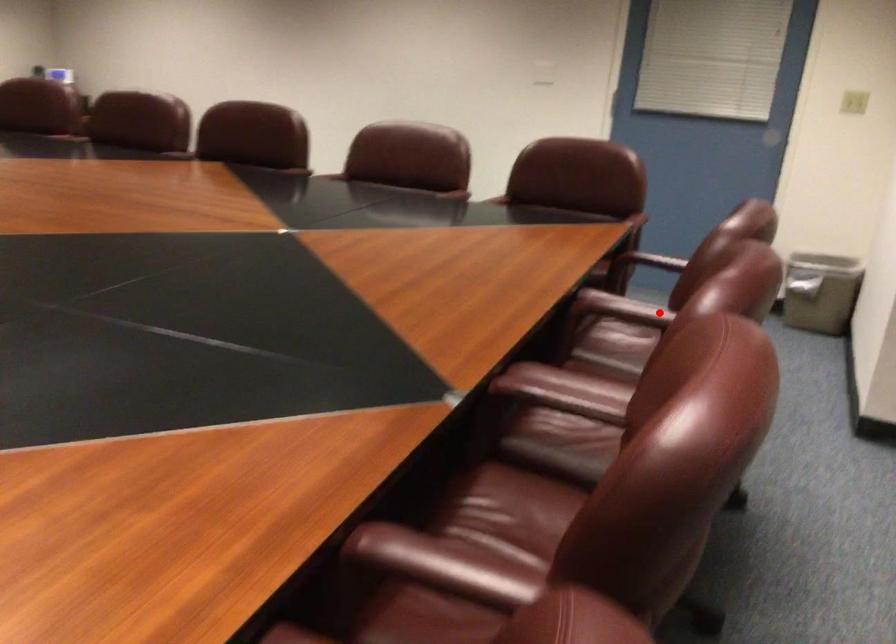
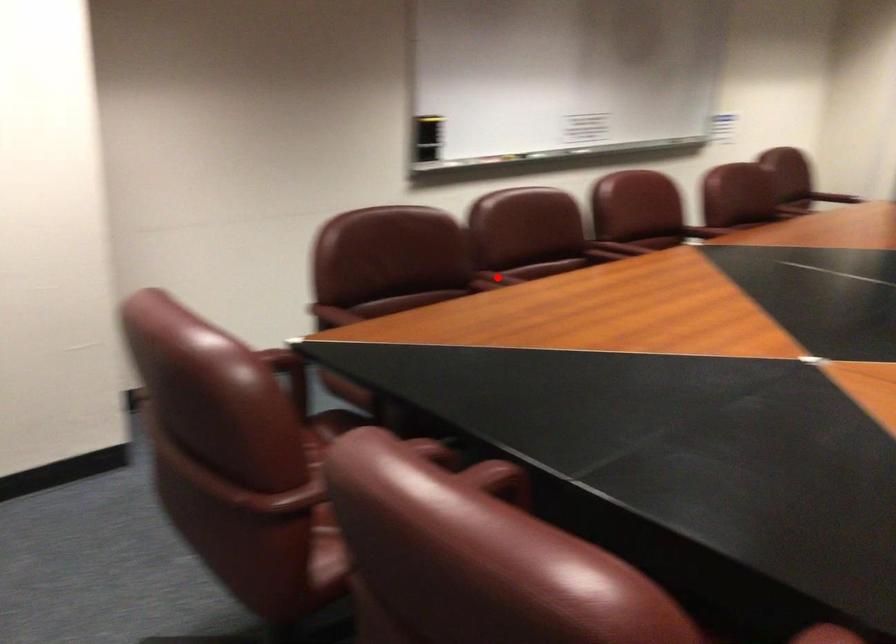
I am providing you with two images of the same scene from different viewpoints. A red point is marked on the first image and another point is marked on the second image. Does the point marked in image1 correspond to the same location as the one in image2?

Yes